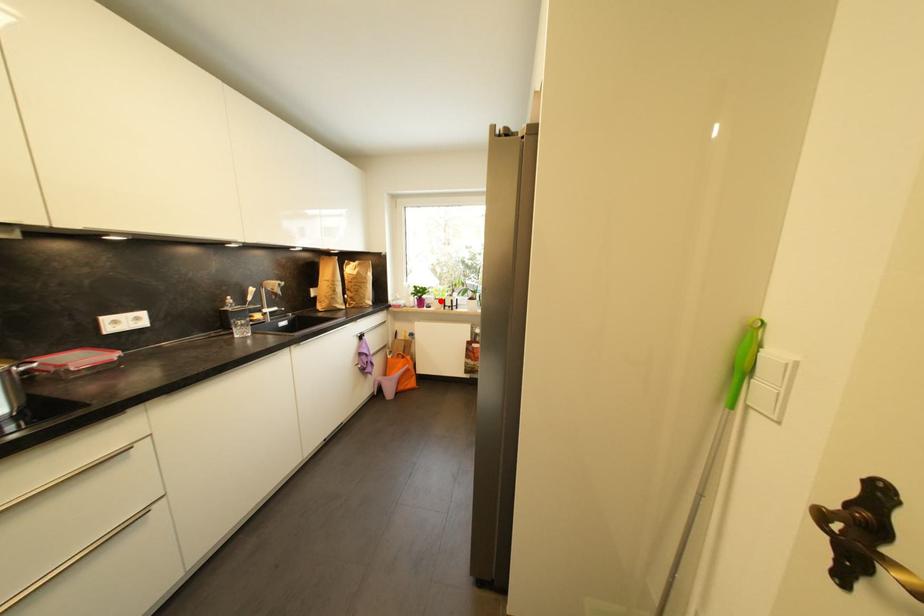
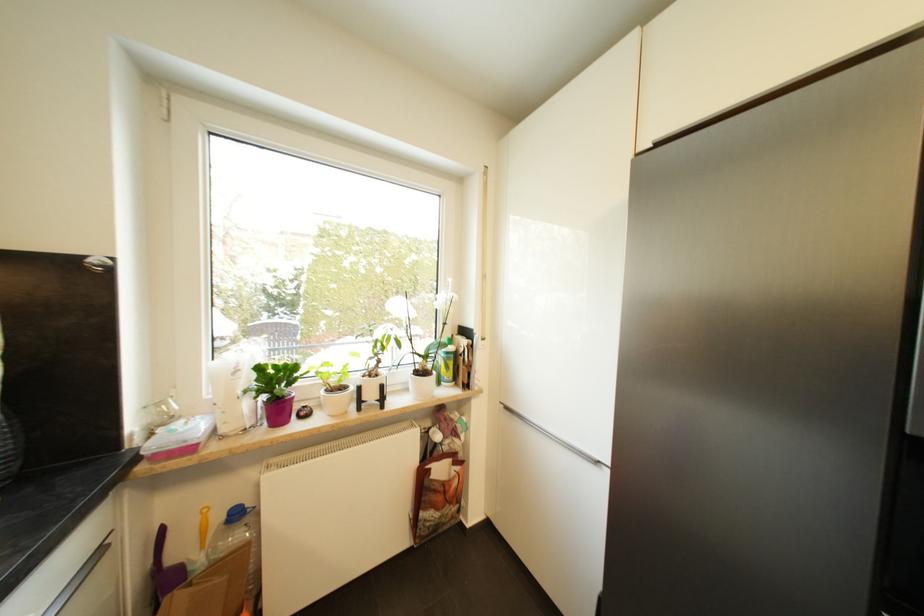
Where in the second image is the point corresponding to the highlighted location from the first image?

(336, 392)